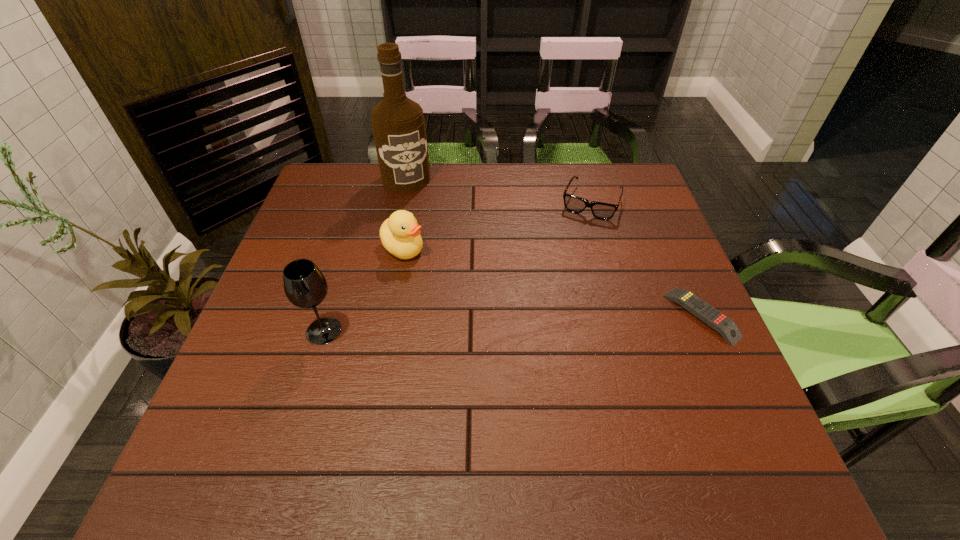
This screenshot has width=960, height=540. What are the coordinates of `vacant space located at the beak of the duck` in the screenshot? It's located at coord(431,272).

Identify the location of vacant space located 0.380m at the beak of the duck. Image resolution: width=960 pixels, height=540 pixels. (521, 353).

Where is `vacant space situated 0.400m at the beak of the duck`? vacant space situated 0.400m at the beak of the duck is located at coordinates (528, 359).

Find the location of a particular element. This screenshot has width=960, height=540. free space located on the label of the tallest object is located at coordinates (441, 260).

Find the location of a particular element. free space located on the label of the tallest object is located at coordinates 425,225.

In order to click on vacant space located on the label of the tallest object in this screenshot , I will do `click(420, 210)`.

I want to click on free point located on the front-facing side of the sunglasses, so click(560, 280).

What are the coordinates of `free region located 0.060m on the front-facing side of the sunglasses` in the screenshot? It's located at (578, 233).

Find the location of a particular element. The height and width of the screenshot is (540, 960). vacant space located 0.300m on the front-facing side of the sunglasses is located at coordinates (554, 294).

What are the coordinates of `alcohol present at the far edge` in the screenshot? It's located at (398, 125).